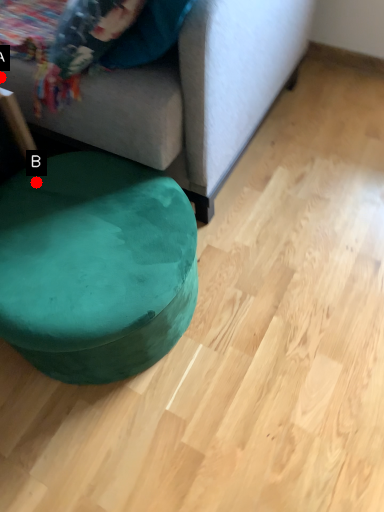
Question: Two points are circled on the image, labeled by A and B beside each circle. Which point is farther from the camera taking this photo?

Choices:
 (A) A is further
 (B) B is further

Answer: (A)